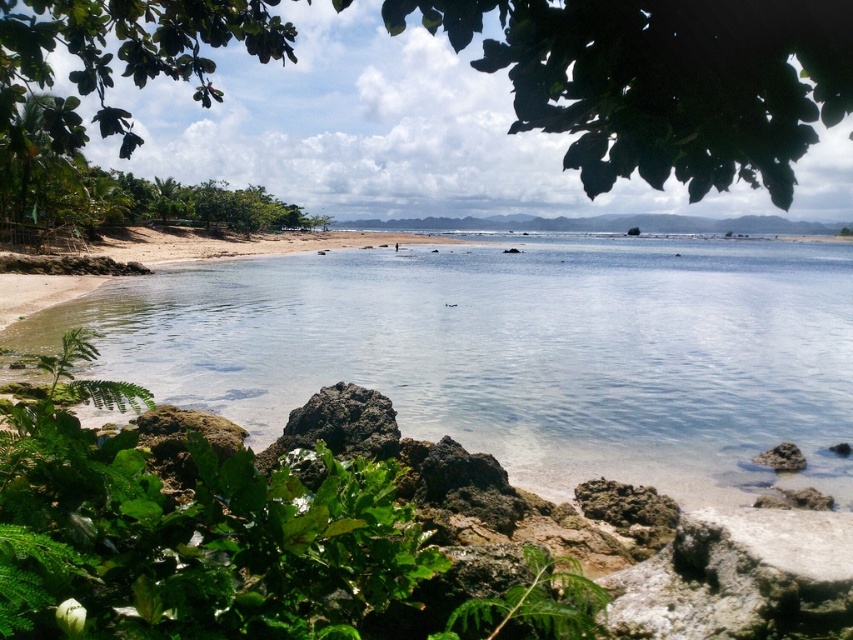
You are standing at the beach and want to take a photo of the green leafy tree at upper center without the clear water at beach left blocking the view. Can you adjust your position to achieve this?

The clear water at beach left has a lesser height compared to the green leafy tree at upper center, so you can move to a higher position or angle your camera upwards to ensure the tree is visible above the water.

You are standing on the beach and see the clear water at beach left and the brown rock at lower right. Which object is closer to your left side?

The clear water at beach left is closer to your left side because it is positioned on the left side of the brown rock at lower right.

You are standing on the beach and want to place a small picnic blanket. Considering the clear water at beach left and the brown rock at lower right, which location would provide a more stable surface for the blanket?

The brown rock at lower right provides a more stable surface because it is smaller and less likely to shift compared to the clear water at beach left, which is larger and possibly deeper.